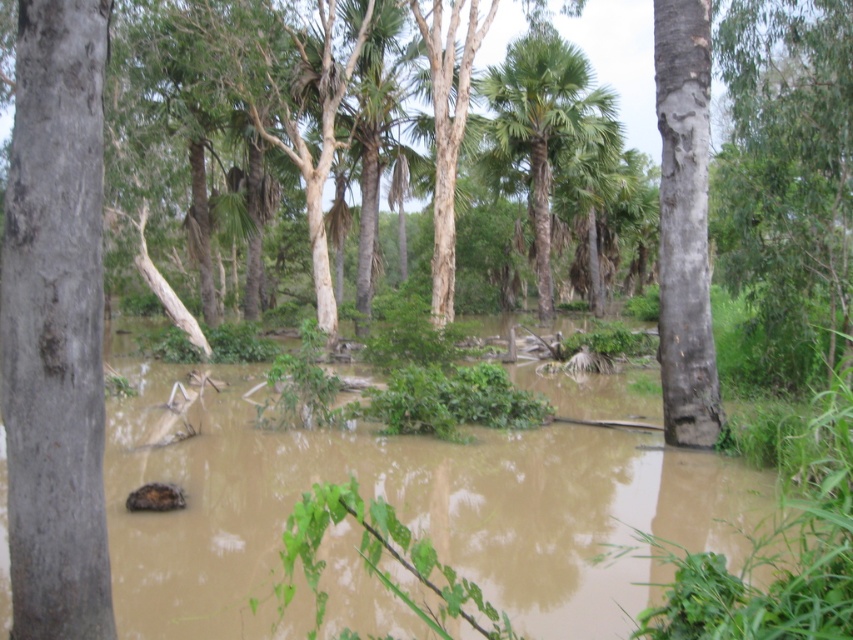
In the scene shown: You are a hiker trying to cross the flooded forest. You see the brown muddy water at center and the gray rough bark tree at left. Which one is closer to you?

The brown muddy water at center is closer to the viewer than the gray rough bark tree at left, so the brown muddy water at center is closer to you.

You are a hiker lost in a flooded forest. You need to find higher ground. You see the brown muddy water at center and the green leafy palm tree at center. Which object is larger and could potentially indicate a safer path?

The green leafy palm tree at center is larger than the brown muddy water at center, so it might indicate a safer path as trees often grow on higher ground.